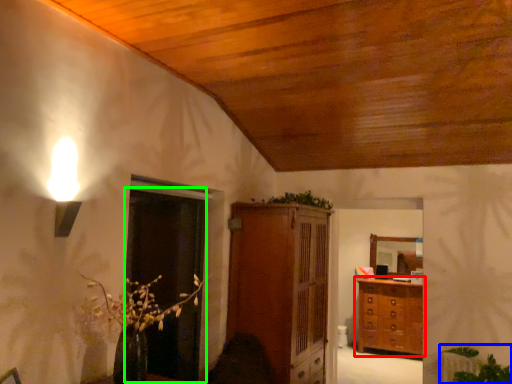
Question: Which object is positioned closest to chest of drawers (highlighted by a red box)? Select from plant (highlighted by a blue box) and glass door (highlighted by a green box).

Choices:
 (A) plant
 (B) glass door

Answer: (A)